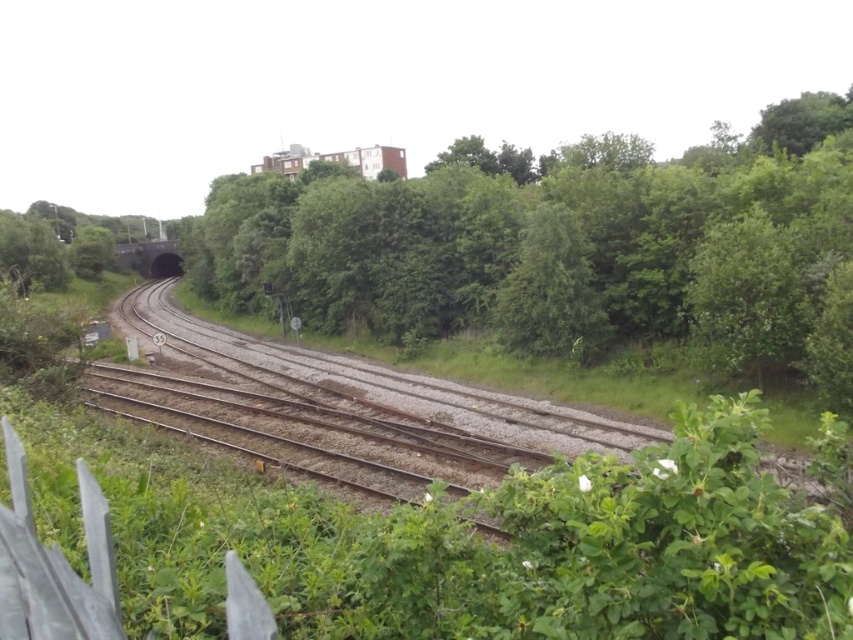
Question: Is green leafy tree at center to the left of brown gravel track at center from the viewer's perspective?

Choices:
 (A) no
 (B) yes

Answer: (A)

Question: Does green leafy tree at center have a larger size compared to brown gravel track at center?

Choices:
 (A) no
 (B) yes

Answer: (B)

Question: Is green leafy tree at center below brown gravel track at center?

Choices:
 (A) no
 (B) yes

Answer: (A)

Question: Which point appears closest to the camera in this image?

Choices:
 (A) (219, 412)
 (B) (820, 176)

Answer: (A)